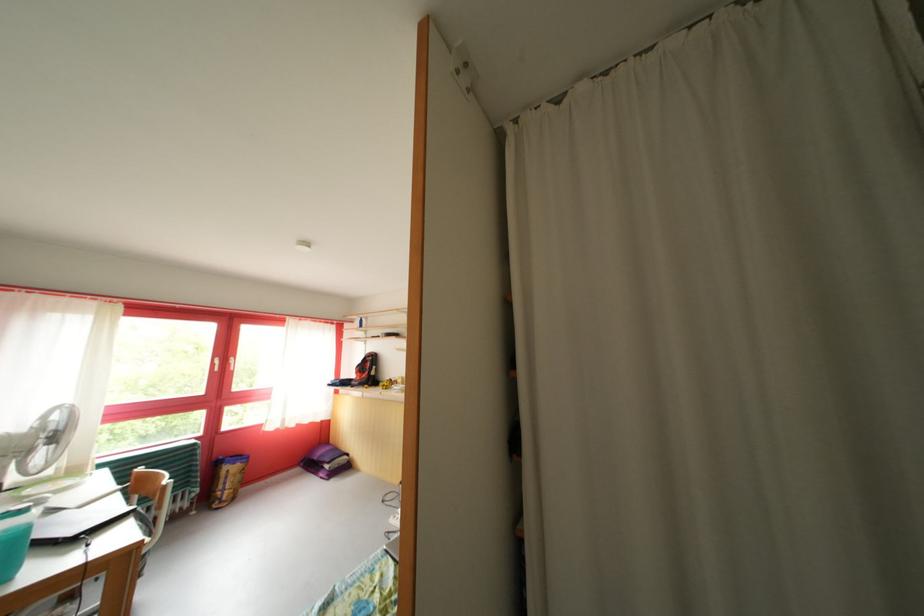
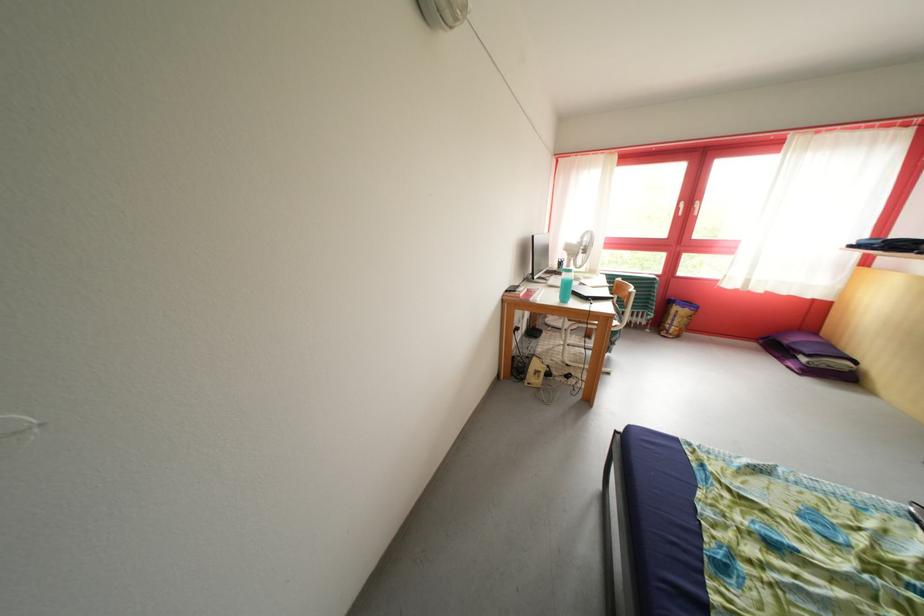
How did the camera likely rotate?

The camera rotated toward left-down.